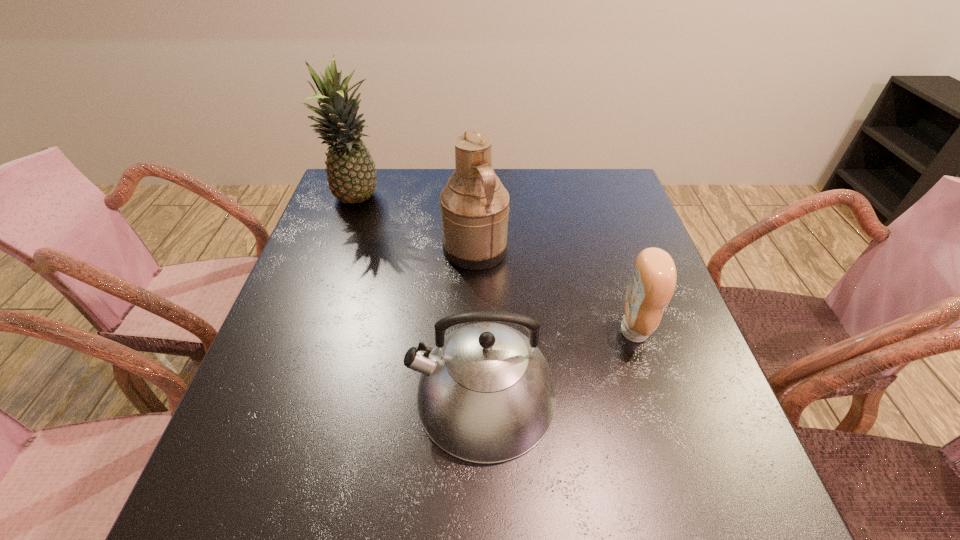
I want to click on vacant space located from the spout of the kettle, so click(x=282, y=395).

Image resolution: width=960 pixels, height=540 pixels. I want to click on vacant region located 0.220m on the label of the rightmost object, so 515,331.

I want to click on vacant space located on the label of the rightmost object, so click(x=562, y=331).

I want to click on vacant area situated on the label of the rightmost object, so click(x=491, y=331).

Where is `object that is at the far edge`? The height and width of the screenshot is (540, 960). object that is at the far edge is located at coordinates (351, 174).

Identify the location of object present at the left edge. (351, 174).

Identify the location of object that is positioned at the right edge. (653, 280).

This screenshot has height=540, width=960. What are the coordinates of `object located at the far left corner` in the screenshot? It's located at (351, 174).

Image resolution: width=960 pixels, height=540 pixels. Identify the location of vacant space at the far edge. (423, 202).

Where is `free space at the left edge`? free space at the left edge is located at coordinates (300, 388).